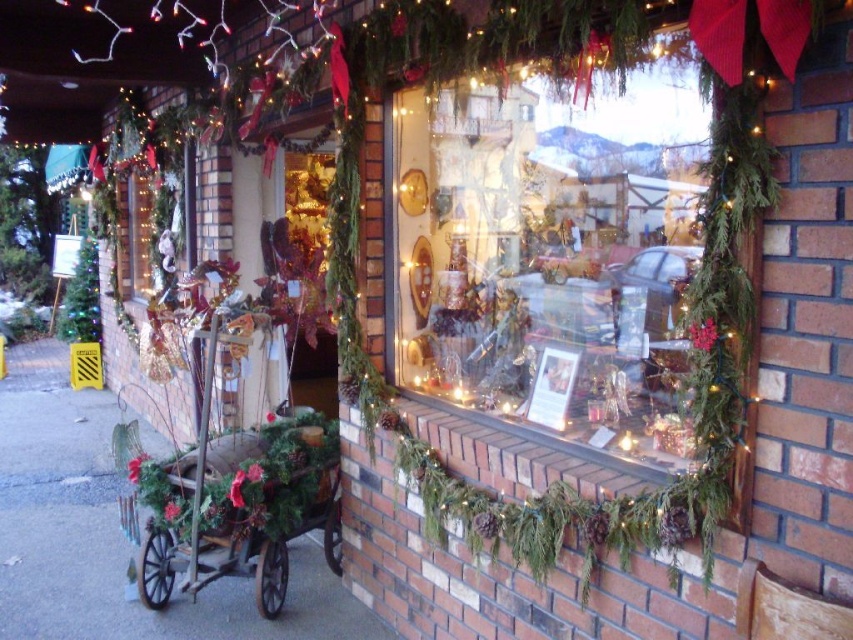
Question: Is matte glass window at center thinner than wooden rustic wagon at center?

Choices:
 (A) yes
 (B) no

Answer: (A)

Question: Can you confirm if matte glass window at center is smaller than wooden rustic wagon at center?

Choices:
 (A) no
 (B) yes

Answer: (A)

Question: Among these objects, which one is nearest to the camera?

Choices:
 (A) matte glass window at center
 (B) wooden rustic wagon at center

Answer: (A)

Question: Does matte glass window at center lie behind wooden rustic wagon at center?

Choices:
 (A) no
 (B) yes

Answer: (A)

Question: Which point is farther to the camera?

Choices:
 (A) wooden rustic wagon at center
 (B) matte glass window at center

Answer: (A)